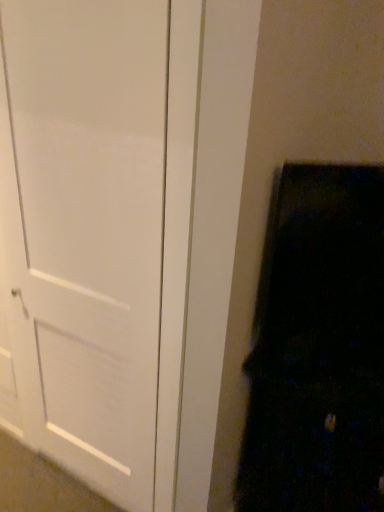
Describe the element at coordinates (123, 231) in the screenshot. This screenshot has height=512, width=384. I see `white glossy door at center` at that location.

At what (x,y) coordinates should I click in order to perform the action: click on white glossy door at center. Please return your answer as a coordinate pair (x, y). The width and height of the screenshot is (384, 512). Looking at the image, I should click on (123, 231).

Image resolution: width=384 pixels, height=512 pixels. In order to click on white glossy door at center in this screenshot , I will do `click(123, 231)`.